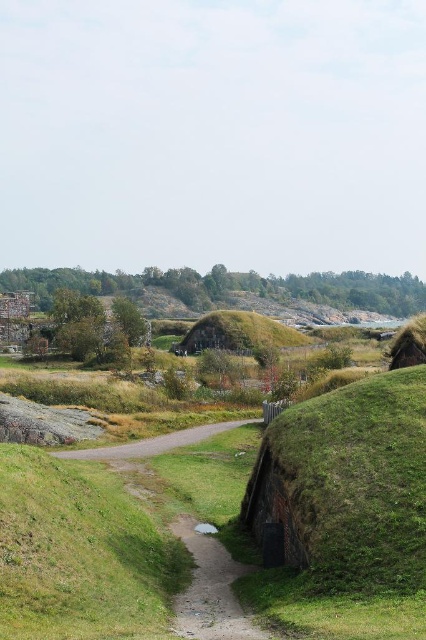
You are a hiker trying to decide between taking the green grassy mound at center or the gravel road at center to reach the huts on the right. Which path would you choose if you want to take the larger one?

The green grassy mound at center is bigger than the gravel road at center, so you should choose the green grassy mound at center if you want to take the larger one.

You are a traveler on foot in this rural area. You need to cross from the left side to the right side of the scene. The gravel road at center is narrower than the green grassy mound at center. Which path would allow you to walk more comfortably, considering space?

The green grassy mound at center is wider than the gravel road at center, so walking on the green grassy mound at center would provide more space and comfort.

You are standing at the entrance of the dirt path in the foreground and want to reach the green grassy mound at center. Which direction should you head to from the path?

The green grassy mound at center is located at point coordinates, so you should head towards the center of the image from the dirt path in the foreground to reach it.